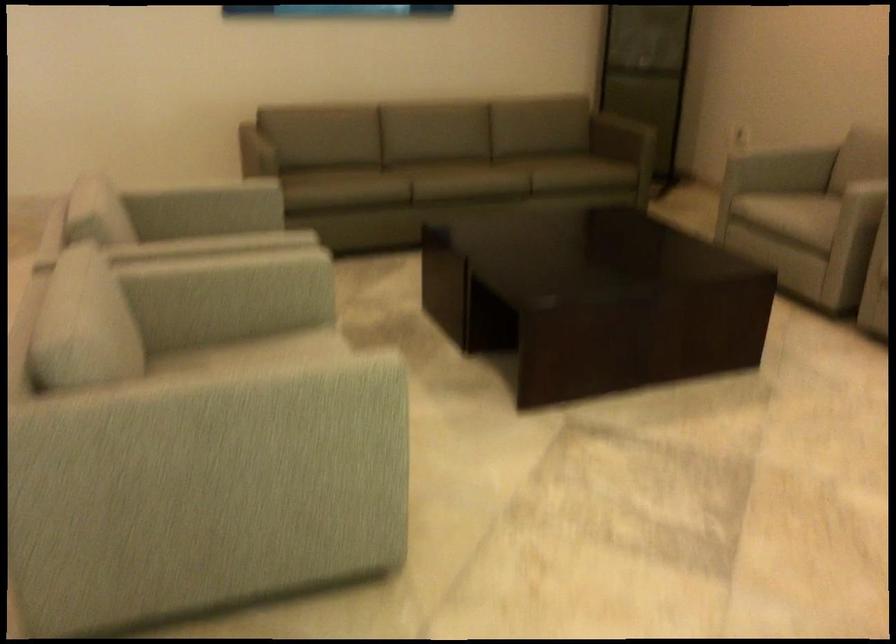
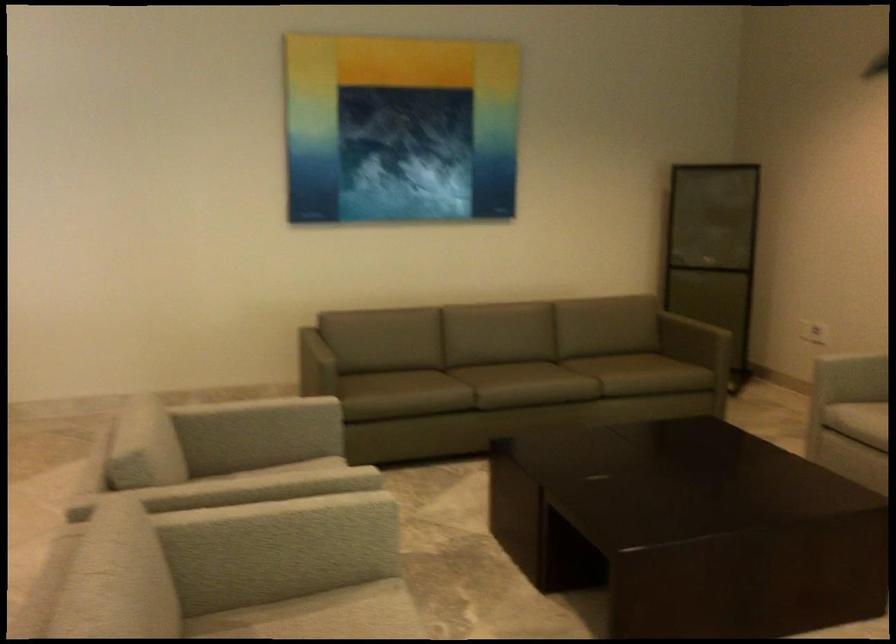
The point at (x=288, y=345) is marked in the first image. Where is the corresponding point in the second image?

(348, 614)